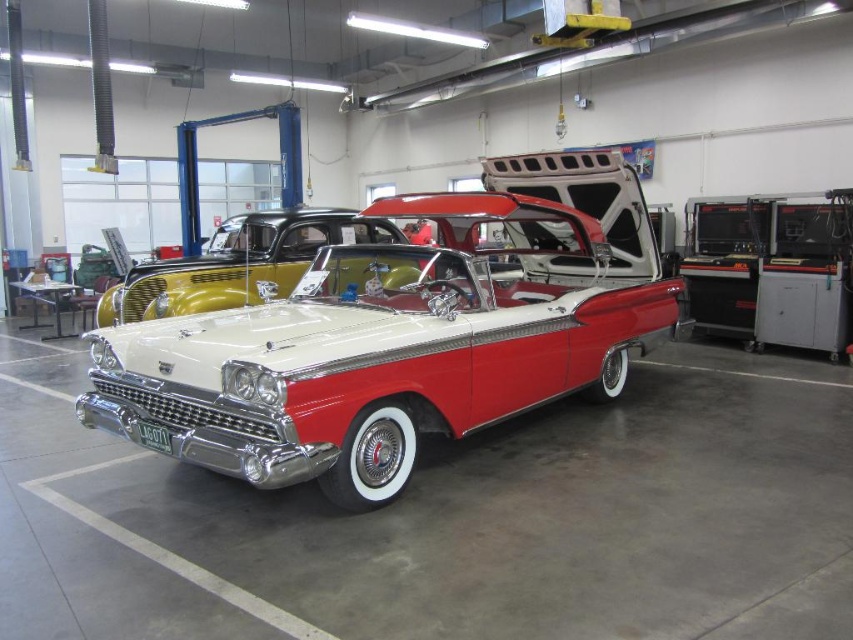
Question: Which of the following is the farthest from the observer?

Choices:
 (A) tap(376, 230)
 (B) tap(645, 312)

Answer: (A)

Question: Does shiny chrome car at center have a smaller size compared to shiny chrome grill at center?

Choices:
 (A) no
 (B) yes

Answer: (A)

Question: Among these points, which one is nearest to the camera?

Choices:
 (A) (233, 266)
 (B) (241, 400)

Answer: (B)

Question: Is shiny chrome car at center to the right of shiny chrome grill at center from the viewer's perspective?

Choices:
 (A) no
 (B) yes

Answer: (B)

Question: Is shiny chrome car at center above shiny chrome grill at center?

Choices:
 (A) no
 (B) yes

Answer: (A)